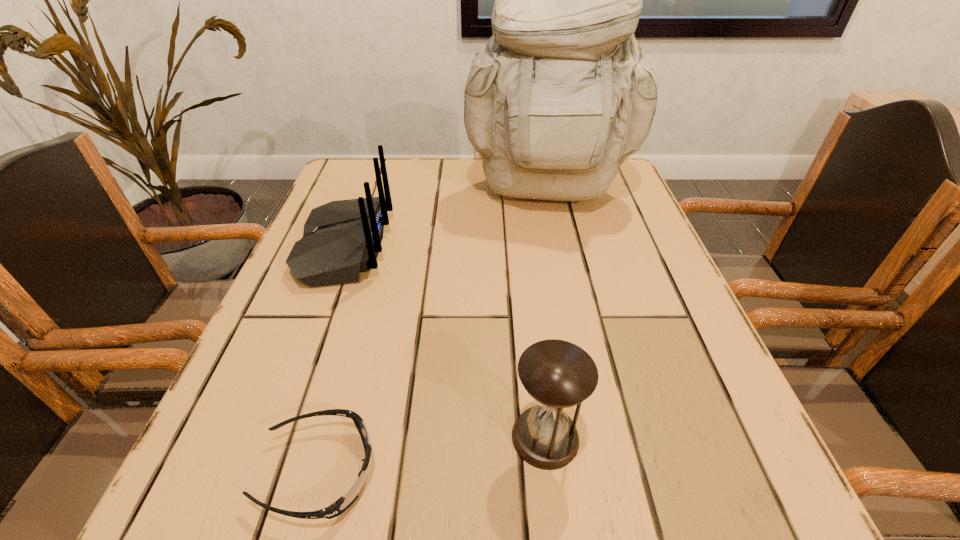
Identify the location of sunglasses at the near edge. (342, 504).

Identify the location of router that is positioned at the left edge. (341, 239).

Image resolution: width=960 pixels, height=540 pixels. I want to click on sunglasses situated at the left edge, so click(342, 504).

This screenshot has height=540, width=960. Find the location of `object at the right edge`. object at the right edge is located at coordinates (562, 93).

Locate an element on the screen. The height and width of the screenshot is (540, 960). object present at the near left corner is located at coordinates (342, 504).

At what (x,y) coordinates should I click in order to perform the action: click on object that is at the far right corner. Please return your answer as a coordinate pair (x, y). Image resolution: width=960 pixels, height=540 pixels. Looking at the image, I should click on (562, 93).

You are a GUI agent. You are given a task and a screenshot of the screen. Output one action in this format:
    pyautogui.click(x=<x>, y=<y>)
    Task: Click on the vacant space at the far edge of the desktop
    This screenshot has width=960, height=540.
    Given the screenshot: What is the action you would take?
    pyautogui.click(x=474, y=160)

Locate an element on the screen. Image resolution: width=960 pixels, height=540 pixels. free location at the near edge of the desktop is located at coordinates (477, 514).

Locate an element on the screen. The width and height of the screenshot is (960, 540). vacant space at the left edge of the desktop is located at coordinates (330, 334).

In order to click on blank space at the right edge in this screenshot , I will do `click(661, 301)`.